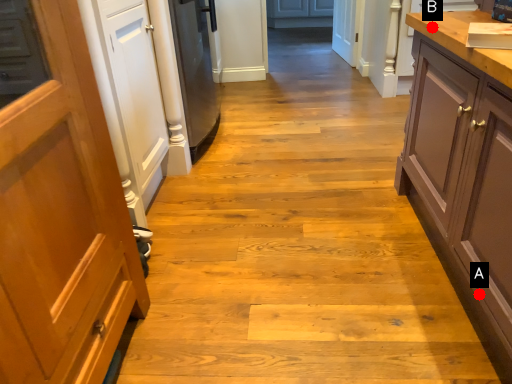
Question: Two points are circled on the image, labeled by A and B beside each circle. Which of the following is the farthest from the observer?

Choices:
 (A) A is further
 (B) B is further

Answer: (B)